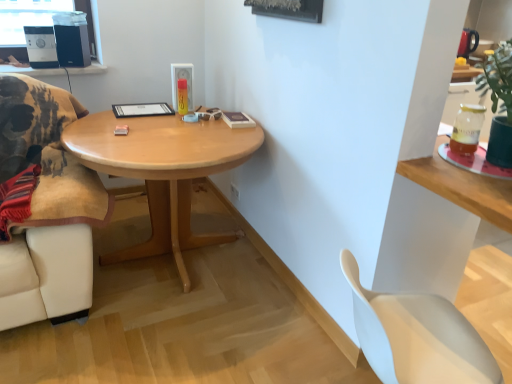
Describe the element at coordinates (41, 46) in the screenshot. I see `matte black speaker at upper left, the second speaker in the right-to-left sequence` at that location.

Image resolution: width=512 pixels, height=384 pixels. I want to click on light wood/finish coffee table at center, so click(162, 171).

What do you see at coordinates (417, 336) in the screenshot? I see `white plastic chair at lower right` at bounding box center [417, 336].

Locate an element on the screen. Image resolution: width=512 pixels, height=384 pixels. black matte speaker at upper left, which is the first speaker from right to left is located at coordinates (72, 45).

From a real-world perspective, is light wood/finish coffee table at center above or below black matte speaker at upper left, which is the first speaker from right to left?

Clearly, from a real-world perspective, light wood/finish coffee table at center is below black matte speaker at upper left, which is the first speaker from right to left.

Is point (132, 159) less distant than point (66, 43)?

Yes.

Looking at their sizes, would you say light wood/finish coffee table at center is wider or thinner than black matte speaker at upper left, positioned as the 2th speaker in left-to-right order?

Clearly, light wood/finish coffee table at center has more width compared to black matte speaker at upper left, positioned as the 2th speaker in left-to-right order.

Measure the distance from light wood/finish coffee table at center to black matte speaker at upper left, positioned as the 2th speaker in left-to-right order.

A distance of 36.12 inches exists between light wood/finish coffee table at center and black matte speaker at upper left, positioned as the 2th speaker in left-to-right order.

Between white plastic chair at lower right and light wood/finish coffee table at center, which one appears on the left side from the viewer's perspective?

From the viewer's perspective, light wood/finish coffee table at center appears more on the left side.

Does white plastic chair at lower right have a lesser width compared to light wood/finish coffee table at center?

Correct, the width of white plastic chair at lower right is less than that of light wood/finish coffee table at center.

Is white plastic chair at lower right looking in the opposite direction of light wood/finish coffee table at center?

No, white plastic chair at lower right is not facing away from light wood/finish coffee table at center.

Considering the sizes of white plastic chair at lower right and light wood/finish coffee table at center in the image, is white plastic chair at lower right bigger or smaller than light wood/finish coffee table at center?

Considering their sizes, white plastic chair at lower right takes up less space than light wood/finish coffee table at center.

Are matte black speaker at upper left, the 1th speaker viewed from the left, and light wood/finish coffee table at center making contact?

No, matte black speaker at upper left, the 1th speaker viewed from the left, is not with light wood/finish coffee table at center.

Is matte black speaker at upper left, the 1th speaker viewed from the left, not within light wood/finish coffee table at center?

Yes, matte black speaker at upper left, the 1th speaker viewed from the left, is outside of light wood/finish coffee table at center.

Which is behind, point (52, 58) or point (178, 142)?

The point (52, 58) is farther from the camera.

Between matte black speaker at upper left, the second speaker in the right-to-left sequence, and light wood/finish coffee table at center, which one has smaller width?

matte black speaker at upper left, the second speaker in the right-to-left sequence, is thinner.

Measure the distance between black matte speaker at upper left, which is the first speaker from right to left, and translucent glass jar at upper right.

black matte speaker at upper left, which is the first speaker from right to left, is 7.14 feet away from translucent glass jar at upper right.

Between black matte speaker at upper left, positioned as the 2th speaker in left-to-right order, and translucent glass jar at upper right, which one appears on the right side from the viewer's perspective?

Positioned to the right is translucent glass jar at upper right.

Who is smaller, black matte speaker at upper left, positioned as the 2th speaker in left-to-right order, or translucent glass jar at upper right?

With smaller size is translucent glass jar at upper right.

Considering the sizes of black matte speaker at upper left, positioned as the 2th speaker in left-to-right order, and translucent glass jar at upper right in the image, is black matte speaker at upper left, positioned as the 2th speaker in left-to-right order, taller or shorter than translucent glass jar at upper right?

In the image, black matte speaker at upper left, positioned as the 2th speaker in left-to-right order, appears to be taller than translucent glass jar at upper right.

Considering the sizes of black matte speaker at upper left, positioned as the 2th speaker in left-to-right order, and light wood/finish coffee table at center in the image, is black matte speaker at upper left, positioned as the 2th speaker in left-to-right order, bigger or smaller than light wood/finish coffee table at center?

Clearly, black matte speaker at upper left, positioned as the 2th speaker in left-to-right order, is smaller in size than light wood/finish coffee table at center.

Considering the relative sizes of black matte speaker at upper left, which is the first speaker from right to left, and light wood/finish coffee table at center in the image provided, is black matte speaker at upper left, which is the first speaker from right to left, wider than light wood/finish coffee table at center?

No, black matte speaker at upper left, which is the first speaker from right to left, is not wider than light wood/finish coffee table at center.

What's the angular difference between black matte speaker at upper left, positioned as the 2th speaker in left-to-right order, and light wood/finish coffee table at center's facing directions?

The facing directions of black matte speaker at upper left, positioned as the 2th speaker in left-to-right order, and light wood/finish coffee table at center are 24.6 degrees apart.

Consider the image. From a real-world perspective, who is located higher, black matte speaker at upper left, positioned as the 2th speaker in left-to-right order, or light wood/finish coffee table at center?

black matte speaker at upper left, positioned as the 2th speaker in left-to-right order, from a real-world perspective.

From a real-world perspective, does light wood/finish coffee table at center stand above translucent glass jar at upper right?

Incorrect, from a real-world perspective, light wood/finish coffee table at center is lower than translucent glass jar at upper right.

Image resolution: width=512 pixels, height=384 pixels. I want to click on coffee table on the left of translucent glass jar at upper right, so click(x=162, y=171).

Considering the relative positions of light wood/finish coffee table at center and translucent glass jar at upper right in the image provided, is light wood/finish coffee table at center to the left or to the right of translucent glass jar at upper right?

light wood/finish coffee table at center is positioned on translucent glass jar at upper right's left side.

Between light wood/finish coffee table at center and translucent glass jar at upper right, which one has larger size?

With larger size is light wood/finish coffee table at center.

Looking at this image, between black matte speaker at upper left, positioned as the 2th speaker in left-to-right order, and white plastic chair at lower right, which one has more height?

white plastic chair at lower right is taller.

Looking at this image, between black matte speaker at upper left, which is the first speaker from right to left, and white plastic chair at lower right, which one is positioned behind?

Positioned behind is black matte speaker at upper left, which is the first speaker from right to left.

Is black matte speaker at upper left, which is the first speaker from right to left, facing towards white plastic chair at lower right?

No.

The height and width of the screenshot is (384, 512). In order to click on the 2nd speaker located above the light wood/finish coffee table at center (from a real-world perspective) in this screenshot , I will do `click(72, 45)`.

You are a GUI agent. You are given a task and a screenshot of the screen. Output one action in this format:
    pyautogui.click(x=<x>, y=<y>)
    Task: Click on the coffee table lying on the left of white plastic chair at lower right
    This screenshot has width=512, height=384.
    Given the screenshot: What is the action you would take?
    pyautogui.click(x=162, y=171)

From the image, which object appears to be nearer to matte black speaker at upper left, the 1th speaker viewed from the left, light wood/finish coffee table at center or white plastic chair at lower right?

Among the two, light wood/finish coffee table at center is located nearer to matte black speaker at upper left, the 1th speaker viewed from the left.

Based on their spatial positions, is white plastic chair at lower right or translucent glass jar at upper right further from matte black speaker at upper left, the 1th speaker viewed from the left?

→ The object further to matte black speaker at upper left, the 1th speaker viewed from the left, is white plastic chair at lower right.

Looking at the image, which one is located further to black matte speaker at upper left, positioned as the 2th speaker in left-to-right order, translucent glass jar at upper right or matte black speaker at upper left, the 1th speaker viewed from the left?

The object further to black matte speaker at upper left, positioned as the 2th speaker in left-to-right order, is translucent glass jar at upper right.

From the image, which object appears to be farther from white plastic chair at lower right, light wood/finish coffee table at center or translucent glass jar at upper right?

Among the two, light wood/finish coffee table at center is located further to white plastic chair at lower right.

Estimate the real-world distances between objects in this image. Which object is further from black matte speaker at upper left, positioned as the 2th speaker in left-to-right order, light wood/finish coffee table at center or matte black speaker at upper left, the 1th speaker viewed from the left?

The object further to black matte speaker at upper left, positioned as the 2th speaker in left-to-right order, is light wood/finish coffee table at center.

Based on the photo, looking at the image, which one is located further to matte black speaker at upper left, the 1th speaker viewed from the left, light wood/finish coffee table at center or black matte speaker at upper left, which is the first speaker from right to left?

light wood/finish coffee table at center.

From the image, which object appears to be farther from matte black speaker at upper left, the second speaker in the right-to-left sequence, black matte speaker at upper left, which is the first speaker from right to left, or translucent glass jar at upper right?

translucent glass jar at upper right.

Based on the photo, estimate the real-world distances between objects in this image. Which object is further from black matte speaker at upper left, which is the first speaker from right to left, translucent glass jar at upper right or light wood/finish coffee table at center?

translucent glass jar at upper right.

In order to click on speaker between matte black speaker at upper left, the 1th speaker viewed from the left, and white plastic chair at lower right, in the horizontal direction in this screenshot , I will do `click(72, 45)`.

Locate an element on the screen. Image resolution: width=512 pixels, height=384 pixels. chair located between matte black speaker at upper left, the second speaker in the right-to-left sequence, and translucent glass jar at upper right in the left-right direction is located at coordinates (417, 336).

Identify the location of speaker that lies between black matte speaker at upper left, positioned as the 2th speaker in left-to-right order, and light wood/finish coffee table at center from top to bottom. (41, 46).

In order to click on coffee table between matte black speaker at upper left, the second speaker in the right-to-left sequence, and white plastic chair at lower right from left to right in this screenshot , I will do `click(162, 171)`.